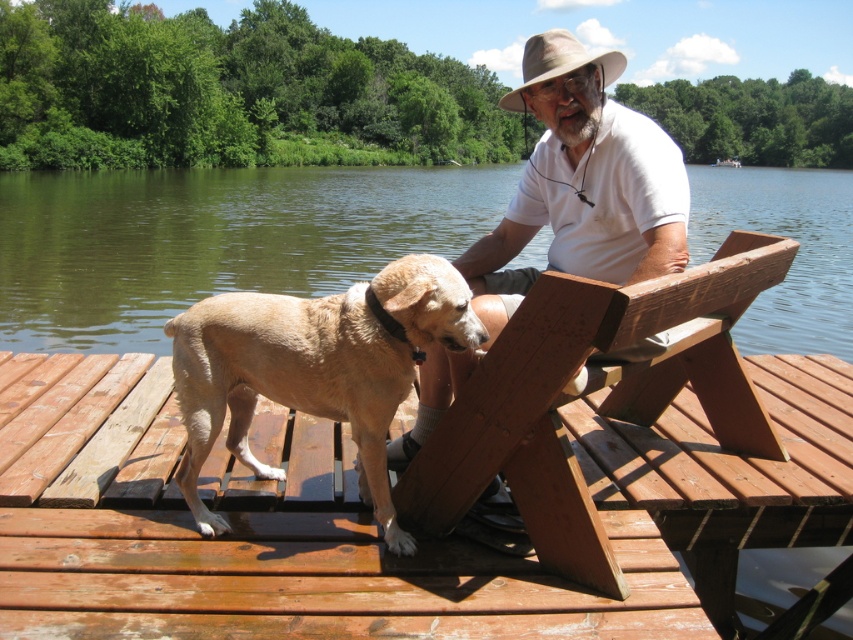
You are standing at the point marked by the coordinates point (451, 484). What object are you standing on?

You are standing on the wooden picnic table at center.